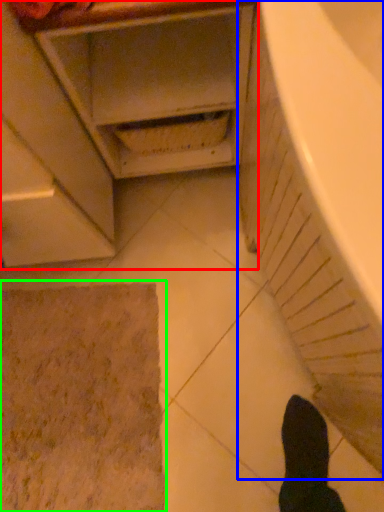
Question: Estimate the real-world distances between objects in this image. Which object is closer to cabinetry (highlighted by a red box), bath (highlighted by a blue box) or bath mat (highlighted by a green box)?

Choices:
 (A) bath
 (B) bath mat

Answer: (A)